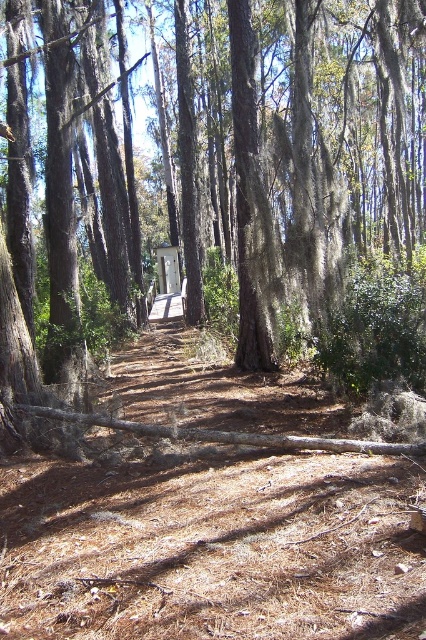
Is brown dirt trail at center below white wood gazebo at center?

Correct, brown dirt trail at center is located below white wood gazebo at center.

Does brown dirt trail at center have a greater width compared to white wood gazebo at center?

Yes.

This screenshot has height=640, width=426. I want to click on brown dirt trail at center, so click(209, 518).

Image resolution: width=426 pixels, height=640 pixels. What do you see at coordinates (296, 154) in the screenshot?
I see `brown rough tree at center` at bounding box center [296, 154].

Does brown rough tree at center come behind white wood gazebo at center?

No, it is in front of white wood gazebo at center.

Where is `brown rough tree at center`? Image resolution: width=426 pixels, height=640 pixels. brown rough tree at center is located at coordinates (296, 154).

Measure the distance between brown rough tree at center and camera.

The distance of brown rough tree at center from camera is 5.25 meters.

Is brown rough tree at center bigger than brown dirt trail at center?

Correct, brown rough tree at center is larger in size than brown dirt trail at center.

This screenshot has height=640, width=426. In order to click on brown rough tree at center in this screenshot , I will do `click(296, 154)`.

Identify the location of brown rough tree at center. (296, 154).